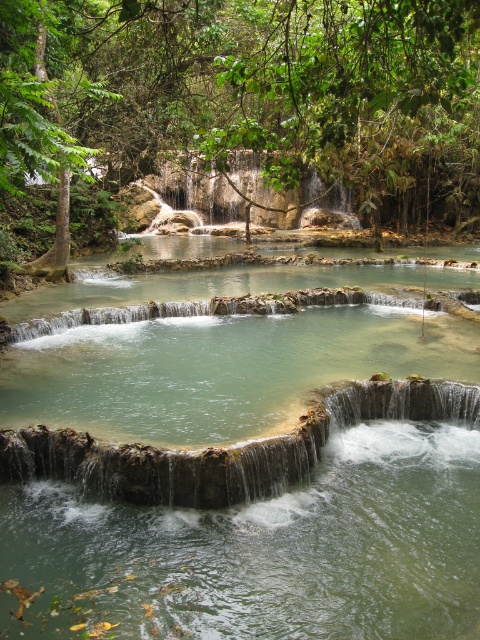
You are standing at the base of the waterfall and want to reach the point marked at coordinates point (175, 436). Given that the safe distance for approaching waterfalls is 10 meters, is it safe to proceed directly to that point?

The point (175, 436) is 9.42 meters from the viewer, which is within the safe distance of 10 meters. Therefore, it is safe to proceed directly to that point.

You are a hiker standing at the base of the green stone waterfall at center and want to take a photo of the green leafy tree at upper center. Since you have a wide angle lens, will you be able to capture the entire tree in the frame without moving your position?

The green leafy tree at upper center is taller than the green stone waterfall at center. Since the tree is taller, you might need to adjust your position or use a different lens to capture the entire tree in the frame.